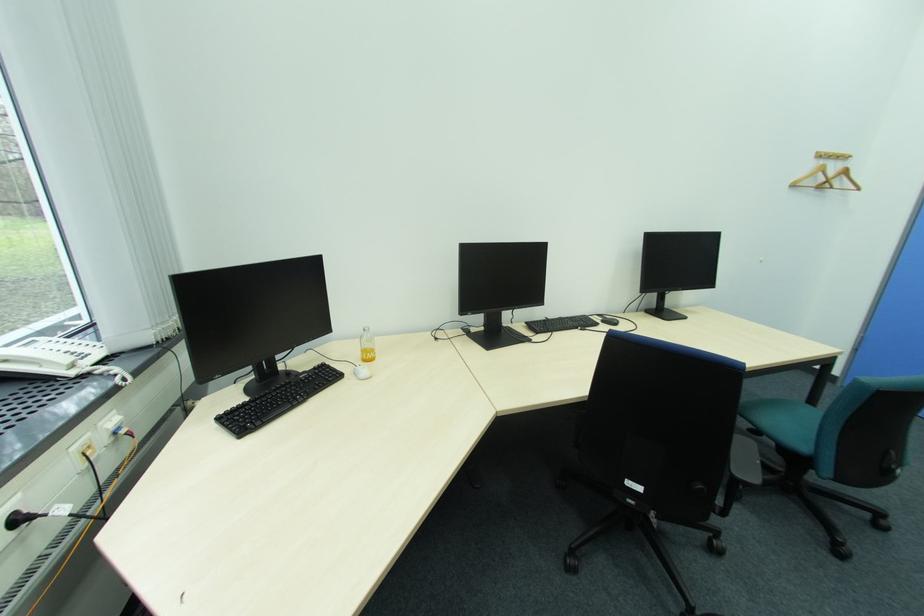
What do you see at coordinates (37, 363) in the screenshot? I see `a white telephone handset` at bounding box center [37, 363].